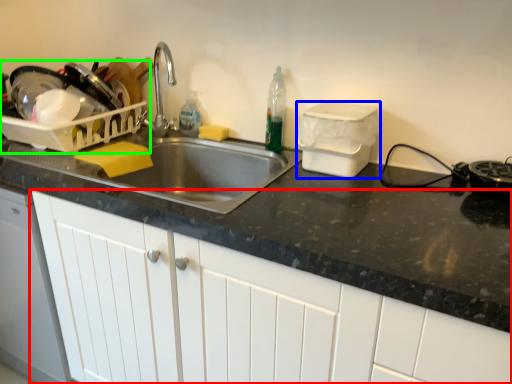
Question: Considering the real-world distances, which object is farthest from cabinetry (highlighted by a red box)? appliance (highlighted by a blue box) or appliance (highlighted by a green box)?

Choices:
 (A) appliance
 (B) appliance

Answer: (B)